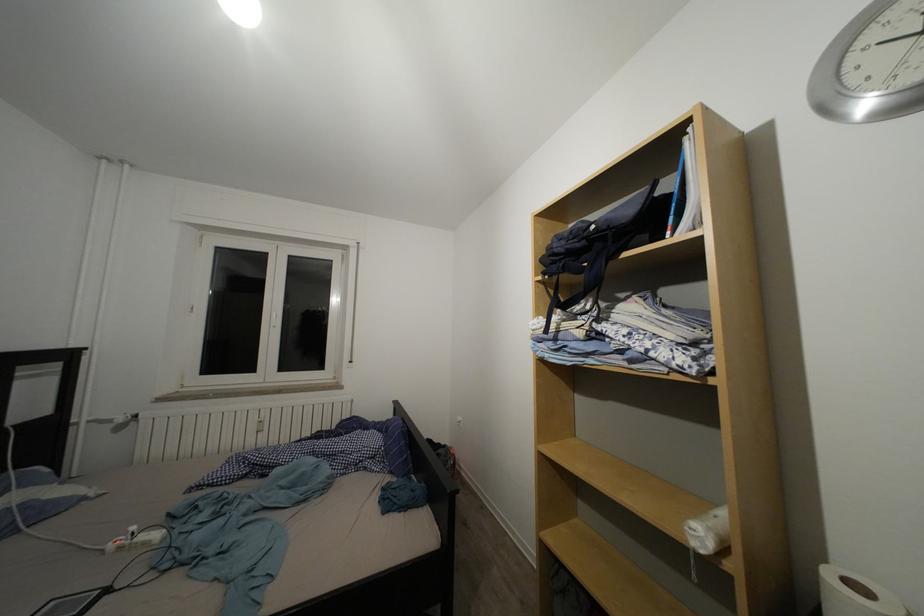
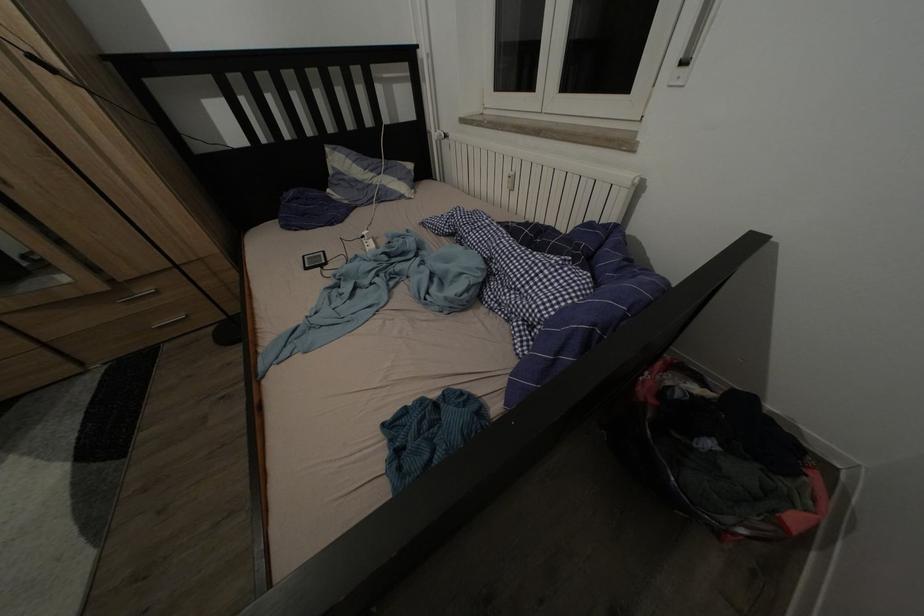
Locate, in the second image, the point that corresponds to point (140, 533) in the first image.

(372, 238)